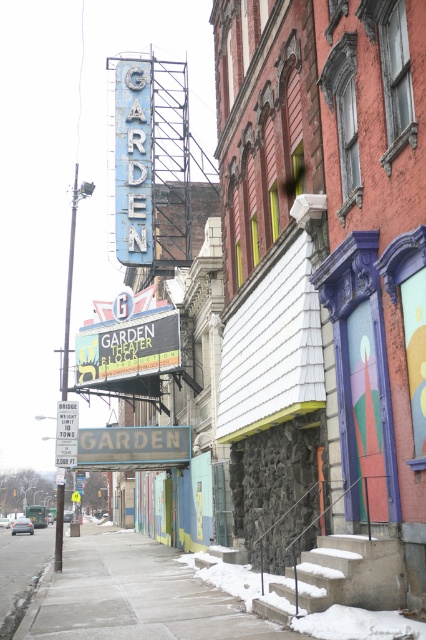
You are a delivery person approaching the Garden Theater Block. You need to place a heavy box on the ground near the blue metallic sign at center. The sidewalk is narrow. Can you place the box on the concrete sidewalk at lower center without blocking the staircase?

The concrete sidewalk at lower center is in front of the blue metallic sign at center, so placing the box there would block the staircase. Choose another location.

You are standing on the sidewalk in front of the Garden Theater Block. You want to walk to the entrance of the theater. The entrance is located at point (135,596). Are you currently on the concrete sidewalk at lower center where the entrance is located?

Yes, you are currently on the concrete sidewalk at lower center where the entrance is located because the entrance is located at point (135,596), which is where the concrete sidewalk at lower center is situated.

You are a pedestrian standing on the sidewalk in front of the Garden Theater Block. You see the blue metallic sign at center and the metallic reflective parking sign at center. Which one is positioned higher up?

The metallic reflective parking sign at center is positioned higher up than the blue metallic sign at center.